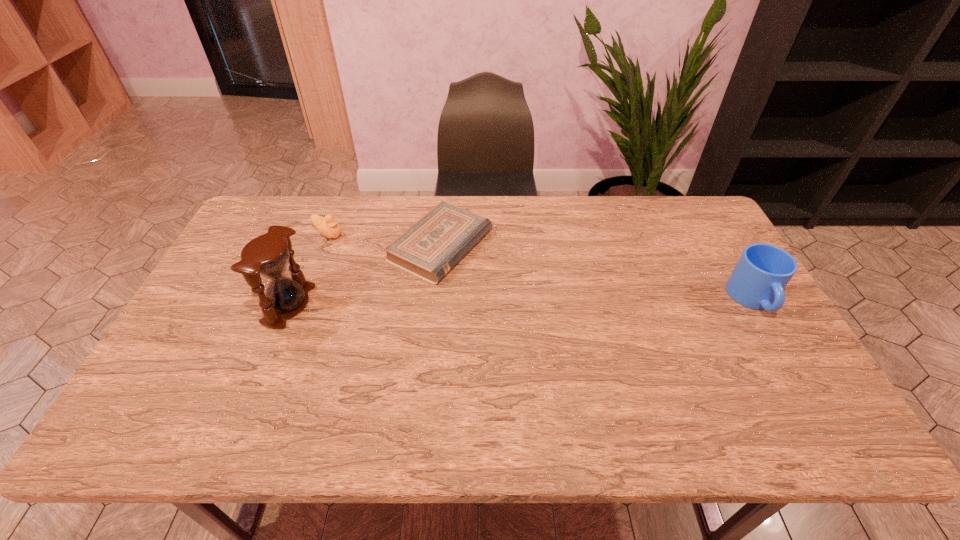
Find the location of a particular element. The image size is (960, 540). free spot on the desktop that is between the tallest object and the third shortest object and is positioned on the spine side of the shortest object is located at coordinates (568, 301).

At what (x,y) coordinates should I click in order to perform the action: click on vacant space on the desktop that is between the hourglass and the mug and is positioned on the face of the duckling. Please return your answer as a coordinate pair (x, y). Image resolution: width=960 pixels, height=540 pixels. Looking at the image, I should click on (453, 303).